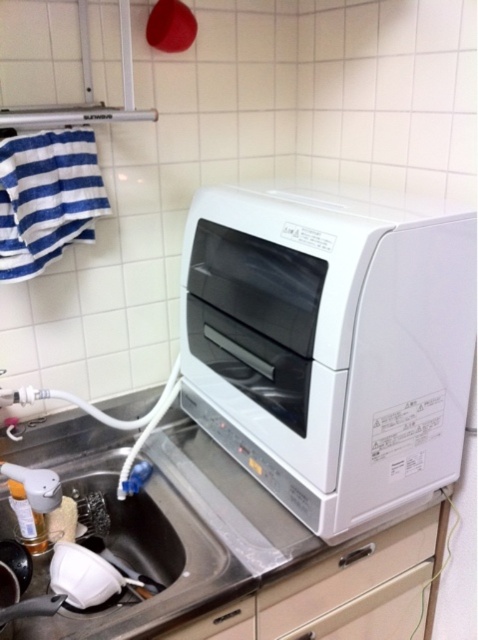
You are a delivery person trying to place a new 12 inch wide package on the counter. The package must be placed exactly where the white plastic drawer at center is currently located. Is there enough space for the package?

The white plastic drawer at center and camera are 36.30 inches apart from each other. Since the package is only 12 inches wide, there is sufficient space to place it where the white plastic drawer at center is located.

You need to place a rectangular cutting board that is 12 inches long on the white glossy countertop at upper center or the white plastic drawer at center. Which surface can accommodate the cutting board based on their widths?

The white glossy countertop at upper center is wider than the white plastic drawer at center, so the cutting board can be placed on the white glossy countertop at upper center.